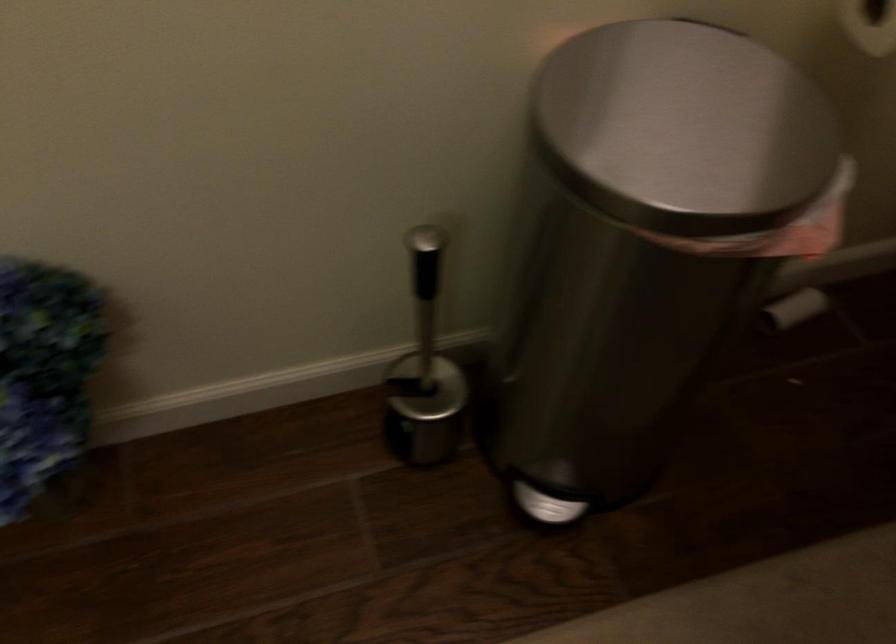
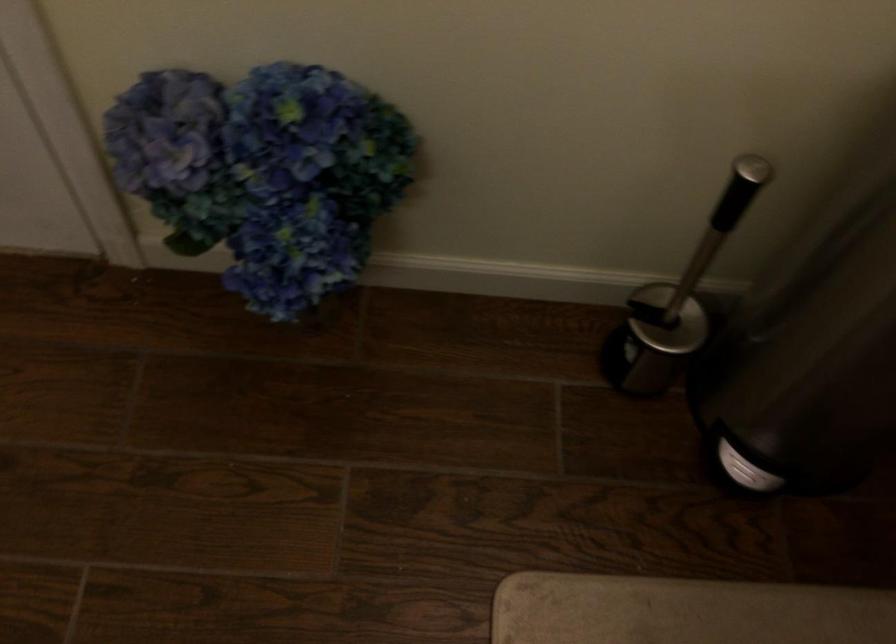
Question: Which direction would the cameraman need to move to produce the second image? Reply with the corresponding letter.

Choices:
 (A) Left
 (B) Right
 (C) Forward
 (D) Backward

Answer: (A)